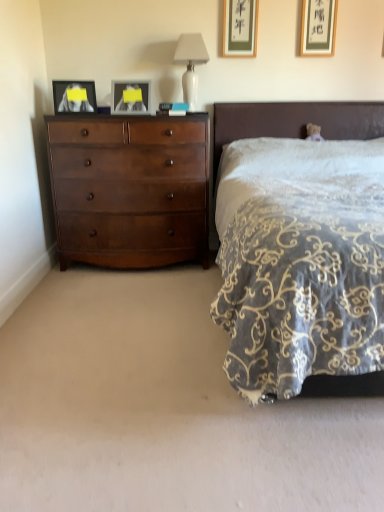
Question: From the image's perspective, would you say matte black picture frame at left, marked as the first picture frame in a left-to-right arrangement, is positioned over matte gold picture frame at upper right, which is the 4th picture frame in left-to-right order?

Choices:
 (A) yes
 (B) no

Answer: (B)

Question: Is matte black picture frame at left, marked as the 4th picture frame in a right-to-left arrangement, outside matte gold picture frame at upper right, which is the 4th picture frame in left-to-right order?

Choices:
 (A) yes
 (B) no

Answer: (A)

Question: Are matte black picture frame at left, marked as the 4th picture frame in a right-to-left arrangement, and matte gold picture frame at upper right, which is the 4th picture frame in left-to-right order, far apart?

Choices:
 (A) no
 (B) yes

Answer: (B)

Question: From a real-world perspective, is matte black picture frame at left, marked as the first picture frame in a left-to-right arrangement, located beneath matte gold picture frame at upper right, which is the 4th picture frame in left-to-right order?

Choices:
 (A) yes
 (B) no

Answer: (A)

Question: Is matte black picture frame at left, marked as the first picture frame in a left-to-right arrangement, wider than matte gold picture frame at upper right, which is the 4th picture frame in left-to-right order?

Choices:
 (A) no
 (B) yes

Answer: (B)

Question: Does point (92, 187) appear closer or farther from the camera than point (145, 103)?

Choices:
 (A) closer
 (B) farther

Answer: (A)

Question: From the image's perspective, is shiny brown dresser at left above or below matte glass picture frame at upper center, the third picture frame viewed from the right?

Choices:
 (A) below
 (B) above

Answer: (A)

Question: Is shiny brown dresser at left bigger or smaller than matte glass picture frame at upper center, the third picture frame viewed from the right?

Choices:
 (A) big
 (B) small

Answer: (A)

Question: Considering the relative positions of shiny brown dresser at left and matte glass picture frame at upper center, the third picture frame viewed from the right, in the image provided, is shiny brown dresser at left to the left or to the right of matte glass picture frame at upper center, the third picture frame viewed from the right,?

Choices:
 (A) right
 (B) left

Answer: (B)

Question: Is matte glass picture frame at upper center, marked as the 2th picture frame in a left-to-right arrangement, bigger or smaller than shiny brown dresser at left?

Choices:
 (A) small
 (B) big

Answer: (A)

Question: From a real-world perspective, relative to shiny brown dresser at left, is matte glass picture frame at upper center, the third picture frame viewed from the right, vertically above or below?

Choices:
 (A) below
 (B) above

Answer: (B)

Question: Considering the positions of matte glass picture frame at upper center, marked as the 2th picture frame in a left-to-right arrangement, and shiny brown dresser at left in the image, is matte glass picture frame at upper center, marked as the 2th picture frame in a left-to-right arrangement, taller or shorter than shiny brown dresser at left?

Choices:
 (A) short
 (B) tall

Answer: (A)

Question: In the image, is matte glass picture frame at upper center, the third picture frame viewed from the right, on the left side or the right side of shiny brown dresser at left?

Choices:
 (A) right
 (B) left

Answer: (A)

Question: Would you say matte glass picture frame at upper center, marked as the 2th picture frame in a left-to-right arrangement, is to the left or to the right of matte gold picture frame at upper center, which is the 2th picture frame in right-to-left order, in the picture?

Choices:
 (A) left
 (B) right

Answer: (A)

Question: From the image's perspective, relative to matte gold picture frame at upper center, the third picture frame in the left-to-right sequence, is matte glass picture frame at upper center, the third picture frame viewed from the right, above or below?

Choices:
 (A) below
 (B) above

Answer: (A)